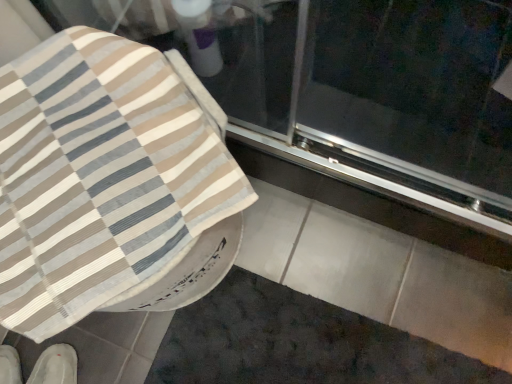
This screenshot has width=512, height=384. I want to click on white fabric slipper at lower left, the 2th footwear from the left, so click(55, 366).

Measure the distance between white fabric slipper at lower left, the 2th footwear from the left, and camera.

A distance of 3.54 feet exists between white fabric slipper at lower left, the 2th footwear from the left, and camera.

You are a GUI agent. You are given a task and a screenshot of the screen. Output one action in this format:
    pyautogui.click(x=<x>, y=<y>)
    Task: Click on the dark gray textured bath mat at lower center
    This screenshot has height=384, width=512.
    Given the screenshot: What is the action you would take?
    pyautogui.click(x=298, y=343)

How many degrees apart are the facing directions of beige striped fabric at upper left and white fabric slipper at lower left, the 2th footwear from the left?

The facing directions of beige striped fabric at upper left and white fabric slipper at lower left, the 2th footwear from the left, are 31.7 degrees apart.

Would you consider beige striped fabric at upper left to be distant from white fabric slipper at lower left, which is the 1th footwear in right-to-left order?

No.

From the image's perspective, between beige striped fabric at upper left and white fabric slipper at lower left, which is the 1th footwear in right-to-left order, which one is located above?

beige striped fabric at upper left appears higher in the image.

Is beige striped fabric at upper left turned away from white fabric slipper at lower left, the 2th footwear from the left?

No, white fabric slipper at lower left, the 2th footwear from the left, is not at the back of beige striped fabric at upper left.

Is point (484, 84) positioned in front of point (13, 366)?

Yes.

Choose the correct answer: Is transparent glass screen door at upper center inside white fabric shoe at lower left, which is the first footwear in left-to-right order, or outside it?

transparent glass screen door at upper center lies outside white fabric shoe at lower left, which is the first footwear in left-to-right order.

From a real-world perspective, between transparent glass screen door at upper center and white fabric shoe at lower left, which is the first footwear in left-to-right order, who is vertically lower?

From a 3D spatial view, white fabric shoe at lower left, which is the first footwear in left-to-right order, is below.

Is transparent glass screen door at upper center wider than white fabric shoe at lower left, the 2th footwear in the right-to-left sequence?

Yes, transparent glass screen door at upper center is wider than white fabric shoe at lower left, the 2th footwear in the right-to-left sequence.

How far apart are transparent glass screen door at upper center and white fabric slipper at lower left, which is the 1th footwear in right-to-left order?

3.60 feet.

Which is more to the right, transparent glass screen door at upper center or white fabric slipper at lower left, which is the 1th footwear in right-to-left order?

Positioned to the right is transparent glass screen door at upper center.

What's the angular difference between transparent glass screen door at upper center and white fabric slipper at lower left, the 2th footwear from the left,'s facing directions?

There is a 28.1-degree angle between the facing directions of transparent glass screen door at upper center and white fabric slipper at lower left, the 2th footwear from the left.

Which of these two, transparent glass screen door at upper center or white fabric slipper at lower left, which is the 1th footwear in right-to-left order, stands taller?

With more height is white fabric slipper at lower left, which is the 1th footwear in right-to-left order.

From a real-world perspective, is beige striped fabric at upper left below transparent glass screen door at upper center?

Incorrect, from a real-world perspective, beige striped fabric at upper left is higher than transparent glass screen door at upper center.

Is beige striped fabric at upper left shorter than transparent glass screen door at upper center?

No, beige striped fabric at upper left is not shorter than transparent glass screen door at upper center.

From the image's perspective, between beige striped fabric at upper left and transparent glass screen door at upper center, who is located below?

From the image's view, beige striped fabric at upper left is below.

At what (x,y) coordinates should I click in order to perform the action: click on blanket in front of the transparent glass screen door at upper center. Please return your answer as a coordinate pair (x, y). The width and height of the screenshot is (512, 384). Looking at the image, I should click on (100, 177).

Is white fabric slipper at lower left, the 2th footwear from the left, to the left or to the right of dark gray textured bath mat at lower center in the image?

Based on their positions, white fabric slipper at lower left, the 2th footwear from the left, is located to the left of dark gray textured bath mat at lower center.

From the image's perspective, is white fabric slipper at lower left, the 2th footwear from the left, beneath dark gray textured bath mat at lower center?

Yes.

Is there a large distance between white fabric slipper at lower left, which is the 1th footwear in right-to-left order, and dark gray textured bath mat at lower center?

No, white fabric slipper at lower left, which is the 1th footwear in right-to-left order, is not far away from dark gray textured bath mat at lower center.

Could you tell me if dark gray textured bath mat at lower center is turned towards white fabric slipper at lower left, the 2th footwear from the left?

No.

Looking at this image, considering the sizes of dark gray textured bath mat at lower center and white fabric slipper at lower left, the 2th footwear from the left, in the image, is dark gray textured bath mat at lower center taller or shorter than white fabric slipper at lower left, the 2th footwear from the left,?

dark gray textured bath mat at lower center is shorter than white fabric slipper at lower left, the 2th footwear from the left.

From the image's perspective, which is above, dark gray textured bath mat at lower center or white fabric slipper at lower left, the 2th footwear from the left?

dark gray textured bath mat at lower center is shown above in the image.

Looking at their sizes, would you say dark gray textured bath mat at lower center is wider or thinner than white fabric slipper at lower left, the 2th footwear from the left?

In the image, dark gray textured bath mat at lower center appears to be wider than white fabric slipper at lower left, the 2th footwear from the left.

Is point (98, 137) more distant than point (237, 285)?

That is False.

From a real-world perspective, is beige striped fabric at upper left located higher than dark gray textured bath mat at lower center?

Yes.

Considering the sizes of beige striped fabric at upper left and dark gray textured bath mat at lower center in the image, is beige striped fabric at upper left taller or shorter than dark gray textured bath mat at lower center?

beige striped fabric at upper left is taller than dark gray textured bath mat at lower center.

There is a beige striped fabric at upper left. In order to click on the 1st footwear below it (from the image's perspective) in this screenshot , I will do `click(55, 366)`.

At what (x,y) coordinates should I click in order to perform the action: click on the 2nd footwear located beneath the transparent glass screen door at upper center (from a real-world perspective). Please return your answer as a coordinate pair (x, y). Image resolution: width=512 pixels, height=384 pixels. Looking at the image, I should click on (10, 365).

From the image, which object appears to be farther from white fabric shoe at lower left, the 2th footwear in the right-to-left sequence, beige striped fabric at upper left or dark gray textured bath mat at lower center?

Based on the image, beige striped fabric at upper left appears to be further to white fabric shoe at lower left, the 2th footwear in the right-to-left sequence.

Based on their spatial positions, is dark gray textured bath mat at lower center or white fabric slipper at lower left, which is the 1th footwear in right-to-left order, closer to white fabric shoe at lower left, which is the first footwear in left-to-right order?

white fabric slipper at lower left, which is the 1th footwear in right-to-left order, is closer to white fabric shoe at lower left, which is the first footwear in left-to-right order.

Estimate the real-world distances between objects in this image. Which object is closer to white fabric slipper at lower left, the 2th footwear from the left, transparent glass screen door at upper center or dark gray textured bath mat at lower center?

The object closer to white fabric slipper at lower left, the 2th footwear from the left, is dark gray textured bath mat at lower center.

When comparing their distances from transparent glass screen door at upper center, does white fabric shoe at lower left, the 2th footwear in the right-to-left sequence, or dark gray textured bath mat at lower center seem closer?

dark gray textured bath mat at lower center.

When comparing their distances from white fabric slipper at lower left, which is the 1th footwear in right-to-left order, does beige striped fabric at upper left or transparent glass screen door at upper center seem further?

The object further to white fabric slipper at lower left, which is the 1th footwear in right-to-left order, is transparent glass screen door at upper center.

From the picture: Considering their positions, is transparent glass screen door at upper center positioned further to white fabric slipper at lower left, which is the 1th footwear in right-to-left order, than white fabric shoe at lower left, which is the first footwear in left-to-right order?

Based on the image, transparent glass screen door at upper center appears to be further to white fabric slipper at lower left, which is the 1th footwear in right-to-left order.

Looking at the image, which one is located closer to dark gray textured bath mat at lower center, white fabric shoe at lower left, which is the first footwear in left-to-right order, or transparent glass screen door at upper center?

Based on the image, transparent glass screen door at upper center appears to be nearer to dark gray textured bath mat at lower center.

From the image, which object appears to be farther from white fabric slipper at lower left, the 2th footwear from the left, transparent glass screen door at upper center or beige striped fabric at upper left?

transparent glass screen door at upper center is further to white fabric slipper at lower left, the 2th footwear from the left.

What are the coordinates of `footwear between beige striped fabric at upper left and white fabric shoe at lower left, which is the first footwear in left-to-right order, from top to bottom` in the screenshot? It's located at (55, 366).

The height and width of the screenshot is (384, 512). I want to click on blanket between transparent glass screen door at upper center and dark gray textured bath mat at lower center in the up-down direction, so click(x=100, y=177).

Locate an element on the screen. This screenshot has width=512, height=384. bath mat between transparent glass screen door at upper center and white fabric slipper at lower left, which is the 1th footwear in right-to-left order, from top to bottom is located at coordinates (298, 343).

Locate an element on the screen. bath mat between transparent glass screen door at upper center and white fabric shoe at lower left, which is the first footwear in left-to-right order, in the vertical direction is located at coordinates (298, 343).